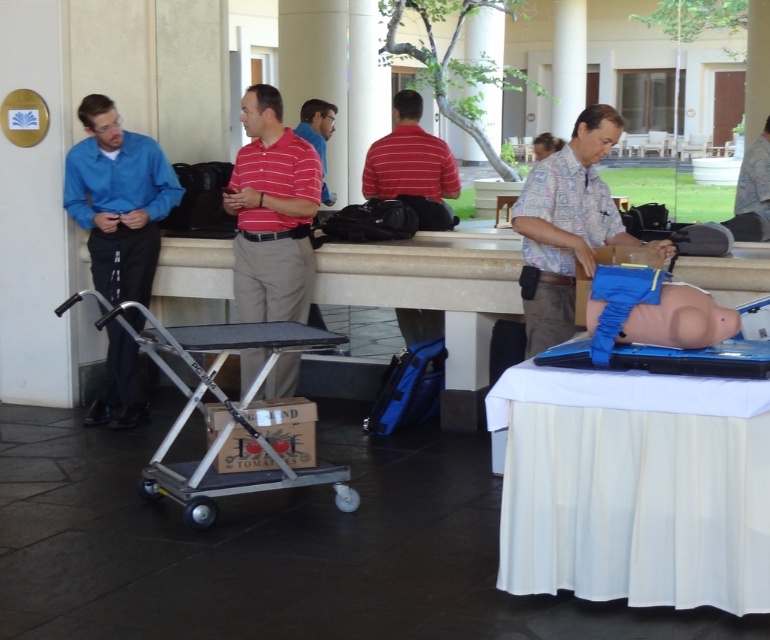
Question: Based on their relative distances, which object is farther from the blue matte shirt at left?

Choices:
 (A) white cloth at lower right
 (B) striped cotton shirt at center
 (C) striped polo shirt at center
 (D) silver metallic cart at center

Answer: (A)

Question: Which point is closer to the camera?

Choices:
 (A) blue matte shirt at left
 (B) hawaiian shirt at center
 (C) red striped shirt at center
 (D) white cloth at lower right

Answer: (D)

Question: Which object is closer to the camera taking this photo?

Choices:
 (A) blue matte shirt at left
 (B) hawaiian shirt at center
 (C) striped polo shirt at center
 (D) white cloth at lower right

Answer: (D)

Question: Can you confirm if hawaiian shirt at center is positioned below striped polo shirt at center?

Choices:
 (A) no
 (B) yes

Answer: (B)

Question: In this image, where is white cloth at lower right located relative to striped cotton shirt at center?

Choices:
 (A) above
 (B) below

Answer: (B)

Question: Is striped cotton shirt at center above silver metallic cart at center?

Choices:
 (A) yes
 (B) no

Answer: (A)